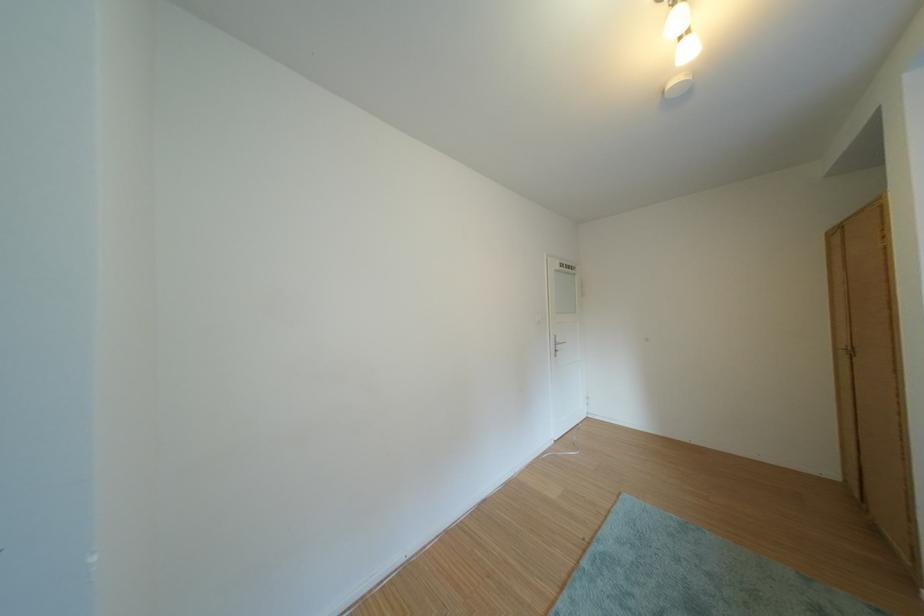
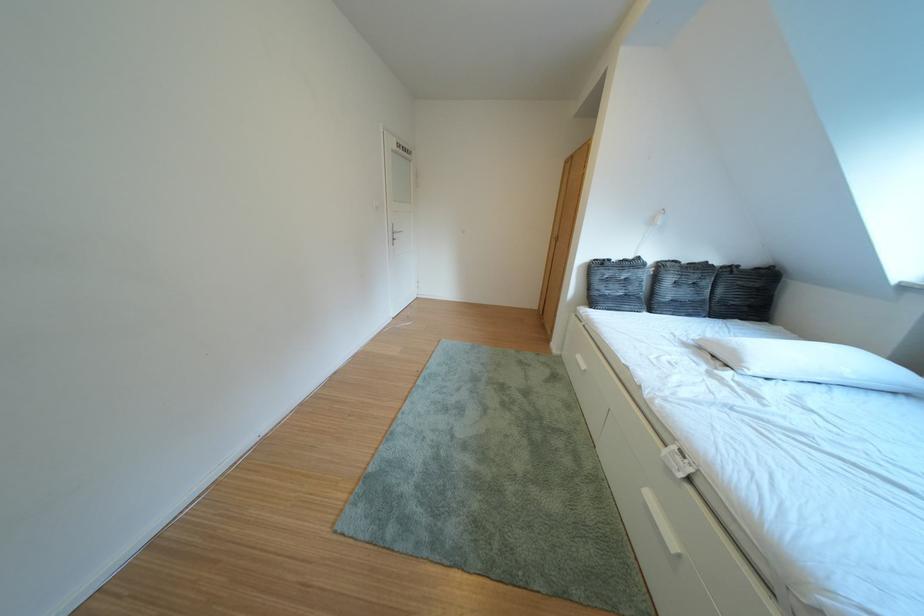
The images are taken continuously from a first-person perspective. In which direction is your viewpoint rotating?

The camera rotated toward right-down.